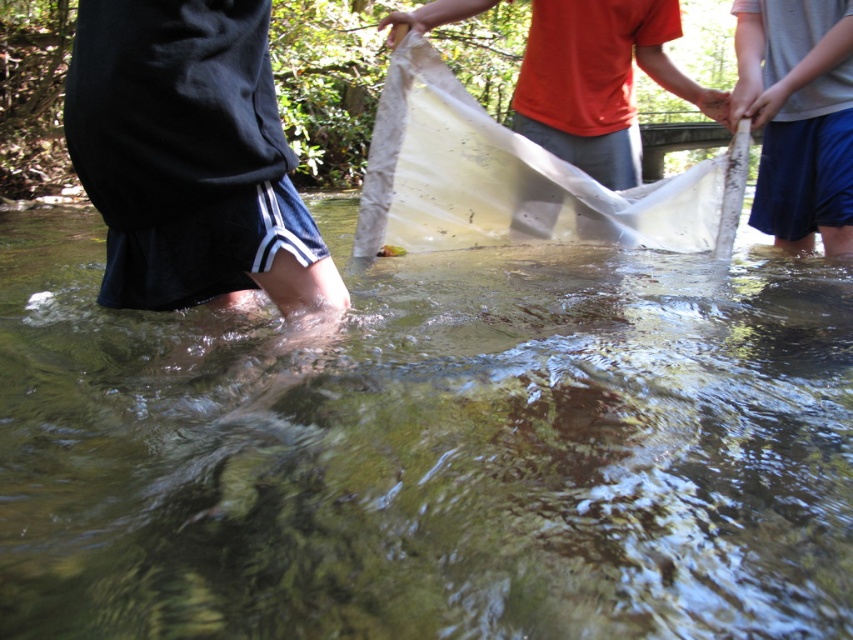
Question: Which is nearer to the clear water at lower center?

Choices:
 (A) gray fabric net at lower right
 (B) smooth skin hand at upper center
 (C) black cotton shorts at left

Answer: (C)

Question: Is transparent plastic net at center positioned in front of smooth skin hand at upper center?

Choices:
 (A) no
 (B) yes

Answer: (B)

Question: Is the position of transparent plastic net at center more distant than that of gray fabric net at lower right?

Choices:
 (A) no
 (B) yes

Answer: (B)

Question: Which of the following is the farthest from the observer?

Choices:
 (A) transparent plastic net at center
 (B) clear water at lower center

Answer: (A)

Question: Which object appears closest to the camera in this image?

Choices:
 (A) transparent plastic net at center
 (B) gray fabric net at lower right

Answer: (B)

Question: Is clear water at lower center closer to camera compared to gray fabric net at lower right?

Choices:
 (A) no
 (B) yes

Answer: (B)